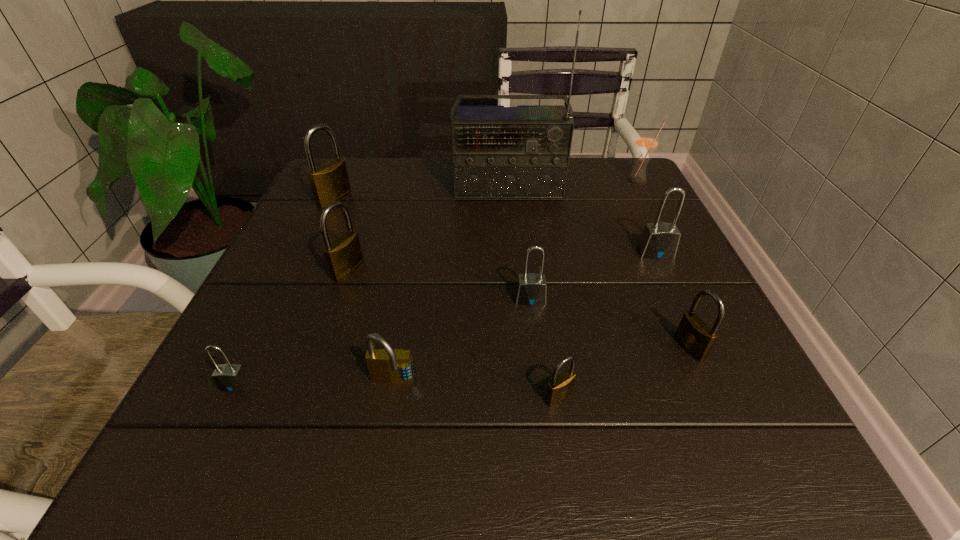
Find the location of a particular element. This screenshot has height=540, width=960. radio receiver is located at coordinates (498, 152).

I want to click on gray radio receiver, so click(x=498, y=152).

Identify the location of the tallest padlock. The height and width of the screenshot is (540, 960). (329, 182).

Find the location of a particular element. The height and width of the screenshot is (540, 960). the farthest padlock is located at coordinates (329, 182).

Image resolution: width=960 pixels, height=540 pixels. I want to click on straw, so click(x=646, y=142).

Where is `the farthest gray padlock`? the farthest gray padlock is located at coordinates pyautogui.click(x=659, y=240).

What are the coordinates of `the rightmost gray padlock` in the screenshot? It's located at (659, 240).

This screenshot has height=540, width=960. What are the coordinates of `the third object from left to right` in the screenshot? It's located at (343, 256).

Find the location of `the second farthest brass padlock`. the second farthest brass padlock is located at coordinates (343, 256).

Find the location of a particular element. the second biggest gray padlock is located at coordinates (531, 290).